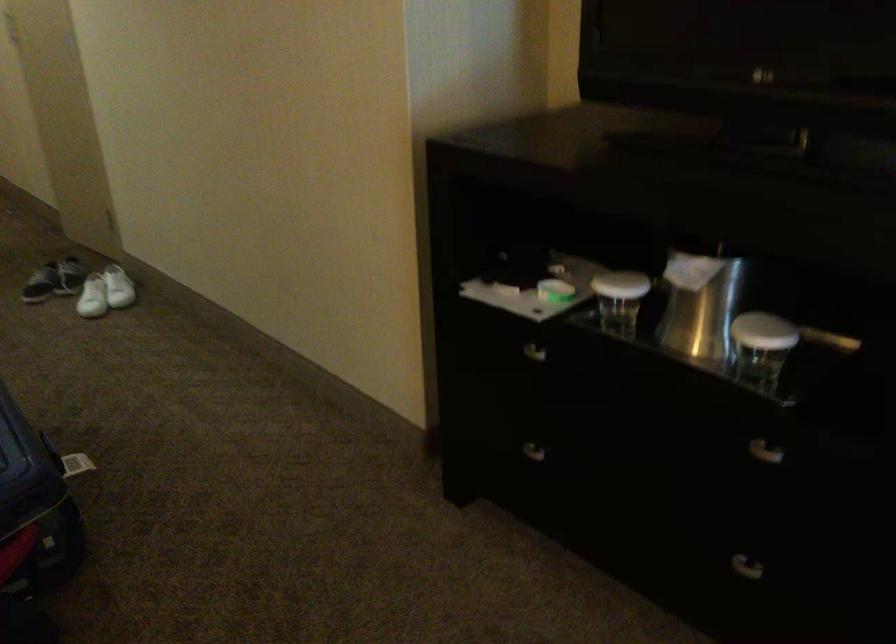
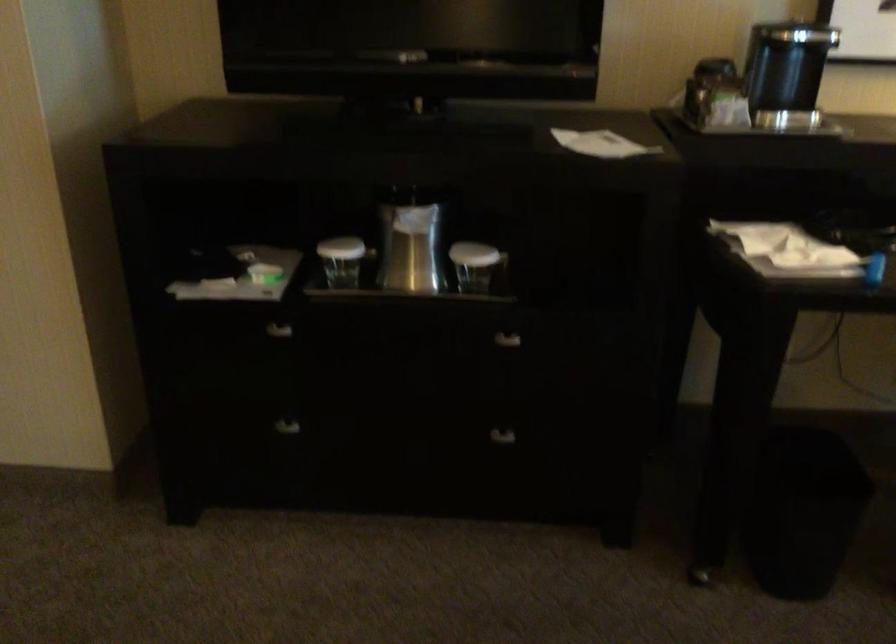
Where in the second image is the point corresponding to [541,460] from the first image?

(283, 435)